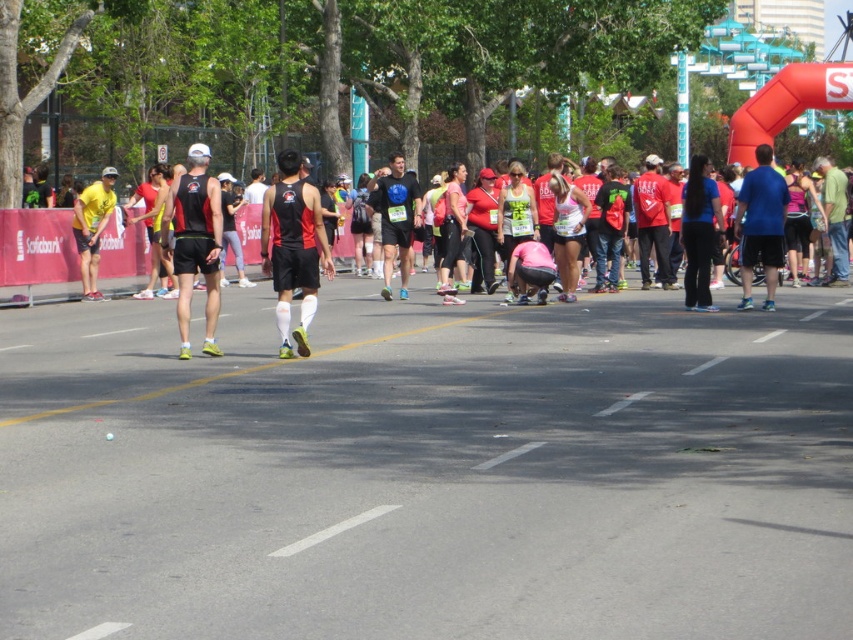
Is black athletic wear at center to the left of yellow matte tank top at left from the viewer's perspective?

No, black athletic wear at center is not to the left of yellow matte tank top at left.

Who is more forward, (180, 288) or (76, 234)?

Point (180, 288) is in front.

Is point (279, 248) in front of point (80, 202)?

Yes, it is.

Locate an element on the screen. black athletic wear at center is located at coordinates (281, 234).

Measure the distance from matte black tank top at center to yellow matte tank top at left.

matte black tank top at center is 7.67 meters from yellow matte tank top at left.

Is matte black tank top at center to the left of yellow matte tank top at left from the viewer's perspective?

In fact, matte black tank top at center is to the right of yellow matte tank top at left.

Is point (287, 160) behind point (80, 212)?

No.

This screenshot has height=640, width=853. Identify the location of matte black tank top at center. (293, 248).

Can you confirm if black athletic wear at center is wider than matte black tank top at center?

Yes, black athletic wear at center is wider than matte black tank top at center.

Is point (372, 200) positioned before point (294, 282)?

That is False.

Which is behind, point (186, 182) or point (267, 259)?

Point (267, 259)

Locate an element on the screen. The height and width of the screenshot is (640, 853). black athletic wear at center is located at coordinates (281, 234).